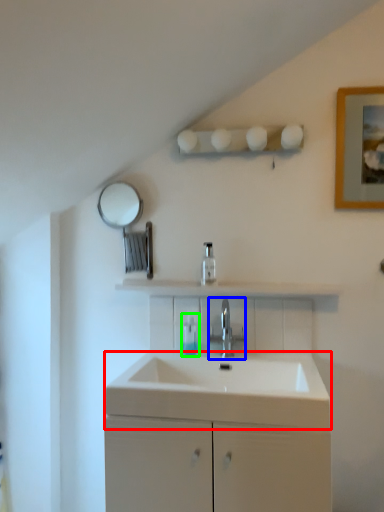
Question: Which object is the farthest from counter top (highlighted by a red box)? Choose among these: tap (highlighted by a blue box) or toiletry (highlighted by a green box).

Choices:
 (A) tap
 (B) toiletry

Answer: (B)